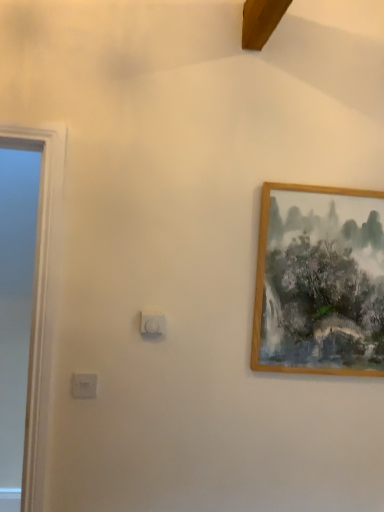
Question: From a real-world perspective, is white plastic light switch at center, the 1th light switch in the top-to-bottom sequence, beneath white plastic light switch at lower left, the 2th light switch positioned from the top?

Choices:
 (A) no
 (B) yes

Answer: (A)

Question: Is white plastic light switch at center, the 2th light switch positioned from the bottom, positioned in front of white plastic light switch at lower left, the first light switch viewed from the left?

Choices:
 (A) no
 (B) yes

Answer: (A)

Question: Could you tell me if white plastic light switch at center, the 2th light switch positioned from the bottom, is facing white plastic light switch at lower left, the 2th light switch positioned from the top?

Choices:
 (A) no
 (B) yes

Answer: (A)

Question: Considering the relative sizes of white plastic light switch at center, the 1th light switch in the top-to-bottom sequence, and white plastic light switch at lower left, the first light switch viewed from the left, in the image provided, is white plastic light switch at center, the 1th light switch in the top-to-bottom sequence, thinner than white plastic light switch at lower left, the first light switch viewed from the left,?

Choices:
 (A) yes
 (B) no

Answer: (B)

Question: Is white plastic light switch at center, which is counted as the 2th light switch, starting from the left, outside of white plastic light switch at lower left, the first light switch viewed from the left?

Choices:
 (A) yes
 (B) no

Answer: (A)

Question: Is white plastic light switch at center, the 2th light switch positioned from the bottom, surrounding white plastic light switch at lower left, positioned as the 1th light switch in bottom-to-top order?

Choices:
 (A) yes
 (B) no

Answer: (B)

Question: Does white plastic light switch at center, which is counted as the 2th light switch, starting from the left, come behind wooden picture frame at upper right?

Choices:
 (A) yes
 (B) no

Answer: (B)

Question: Is white plastic light switch at center, the 2th light switch positioned from the bottom, closer to camera compared to wooden picture frame at upper right?

Choices:
 (A) no
 (B) yes

Answer: (B)

Question: Is white plastic light switch at center, the 2th light switch positioned from the bottom, wider than wooden picture frame at upper right?

Choices:
 (A) yes
 (B) no

Answer: (B)

Question: From the image's perspective, would you say white plastic light switch at center, the 1th light switch when ordered from right to left, is shown under wooden picture frame at upper right?

Choices:
 (A) yes
 (B) no

Answer: (A)

Question: From the image's perspective, is white plastic light switch at center, which is counted as the 2th light switch, starting from the left, above wooden picture frame at upper right?

Choices:
 (A) no
 (B) yes

Answer: (A)

Question: Is white plastic light switch at center, the 1th light switch when ordered from right to left, oriented away from wooden picture frame at upper right?

Choices:
 (A) no
 (B) yes

Answer: (A)

Question: Considering the relative sizes of wooden picture frame at upper right and white plastic light switch at center, the 1th light switch when ordered from right to left, in the image provided, is wooden picture frame at upper right smaller than white plastic light switch at center, the 1th light switch when ordered from right to left,?

Choices:
 (A) no
 (B) yes

Answer: (A)